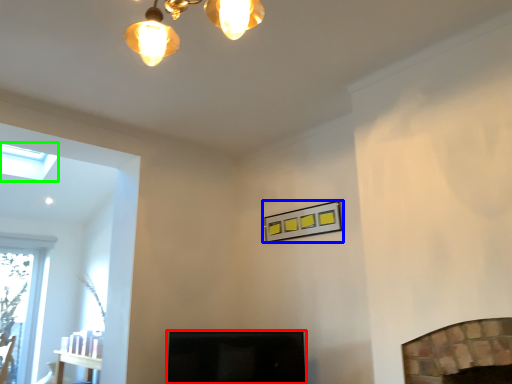
Question: Which object is the closest to the screen door (highlighted by a red box)? Choose among these: picture frame (highlighted by a blue box) or lamp (highlighted by a green box).

Choices:
 (A) picture frame
 (B) lamp

Answer: (A)